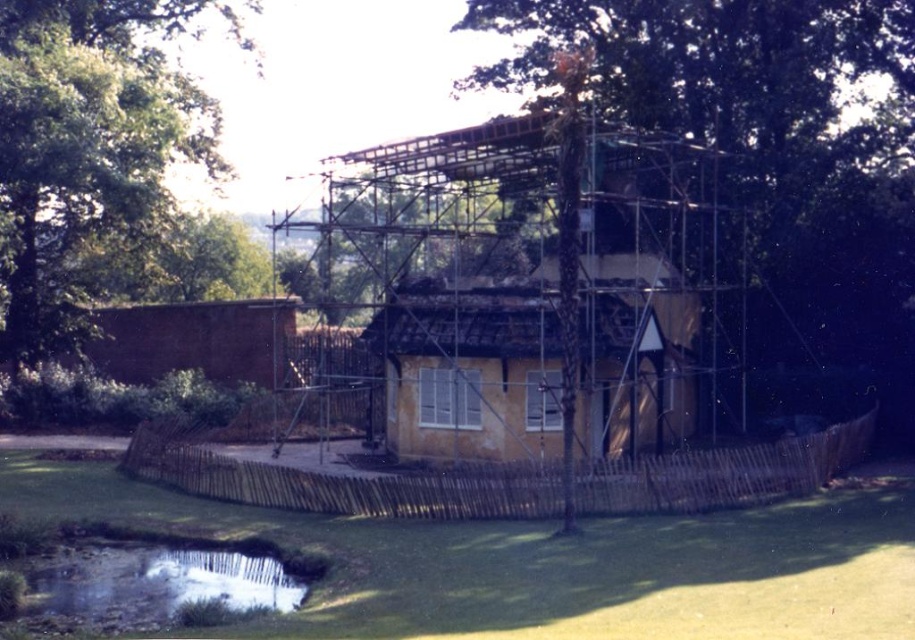
Question: Which object appears closest to the camera in this image?

Choices:
 (A) reflective gravel creek at lower left
 (B) yellow stucco hut at center

Answer: (A)

Question: Which is farther from the yellow stucco hut at center?

Choices:
 (A) green leafy tree at upper left
 (B) green leafy tree at center
 (C) yellow wood house at center

Answer: (A)

Question: Can you confirm if yellow stucco hut at center is wider than reflective gravel creek at lower left?

Choices:
 (A) yes
 (B) no

Answer: (A)

Question: Is green leafy tree at upper left closer to camera compared to yellow wood house at center?

Choices:
 (A) yes
 (B) no

Answer: (B)

Question: Which point is closer to the camera?

Choices:
 (A) reflective gravel creek at lower left
 (B) green leafy tree at upper left
 (C) green leafy tree at center
 (D) yellow wood house at center

Answer: (A)

Question: Is yellow stucco hut at center to the right of reflective gravel creek at lower left from the viewer's perspective?

Choices:
 (A) yes
 (B) no

Answer: (A)